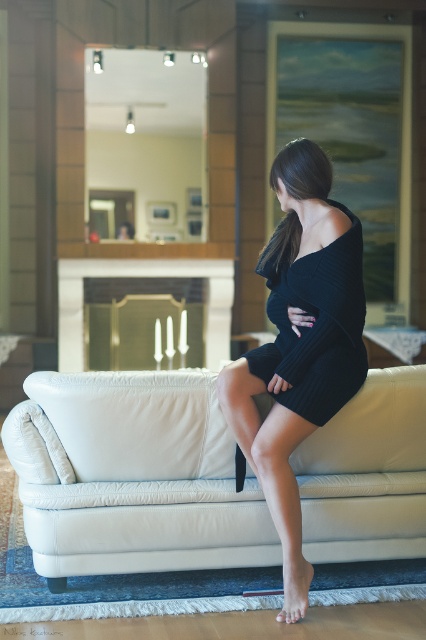
Is black knitted dress at center above black ribbed dress at center?

Actually, black knitted dress at center is below black ribbed dress at center.

Is black knitted dress at center closer to the viewer compared to black ribbed dress at center?

No, it is not.

Locate an element on the screen. black knitted dress at center is located at coordinates (299, 346).

Which is below, white leather couch at center or black ribbed dress at center?

white leather couch at center is below.

Is point (141, 570) more distant than point (279, 369)?

Yes.

Who is more distant from viewer, (356,460) or (282,291)?

The point (356,460) is more distant.

What are the coordinates of `white leather couch at center` in the screenshot? It's located at tap(132, 476).

Who is lower down, white leather couch at center or black knitted dress at center?

white leather couch at center is below.

Between white leather couch at center and black knitted dress at center, which one appears on the right side from the viewer's perspective?

black knitted dress at center is more to the right.

The width and height of the screenshot is (426, 640). Find the location of `white leather couch at center`. white leather couch at center is located at coordinates (132, 476).

Where is `white leather couch at center`? This screenshot has width=426, height=640. white leather couch at center is located at coordinates (132, 476).